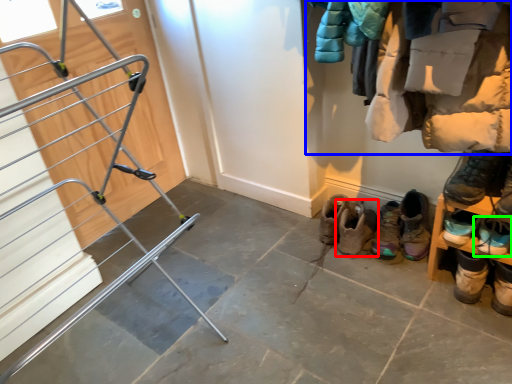
Question: Estimate the real-world distances between objects in this image. Which object is closer to footwear (highlighted by a red box), closet (highlighted by a blue box) or footwear (highlighted by a green box)?

Choices:
 (A) closet
 (B) footwear

Answer: (B)